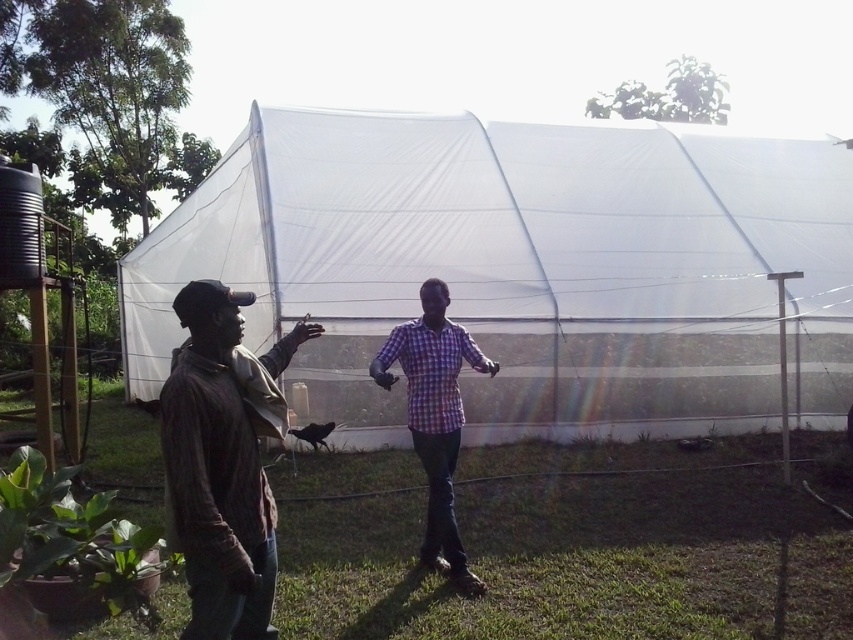
Who is shorter, brown corduroy jacket at center or checkered fabric shirt at center?

brown corduroy jacket at center is shorter.

Which is more to the right, brown corduroy jacket at center or checkered fabric shirt at center?

From the viewer's perspective, checkered fabric shirt at center appears more on the right side.

I want to click on brown corduroy jacket at center, so click(x=223, y=461).

Between transparent plastic tent at center and brown corduroy jacket at center, which one has more height?

With more height is transparent plastic tent at center.

Which is below, transparent plastic tent at center or brown corduroy jacket at center?

brown corduroy jacket at center is below.

Where is `transparent plastic tent at center`? Image resolution: width=853 pixels, height=640 pixels. transparent plastic tent at center is located at coordinates (521, 268).

The image size is (853, 640). Identify the location of transparent plastic tent at center. (521, 268).

Which of these two, transparent plastic tent at center or checkered fabric shirt at center, stands shorter?

Standing shorter between the two is checkered fabric shirt at center.

Who is positioned more to the right, transparent plastic tent at center or checkered fabric shirt at center?

transparent plastic tent at center

Measure the distance between point (577, 204) and camera.

They are 10.19 meters apart.

Locate an element on the screen. The image size is (853, 640). transparent plastic tent at center is located at coordinates (521, 268).